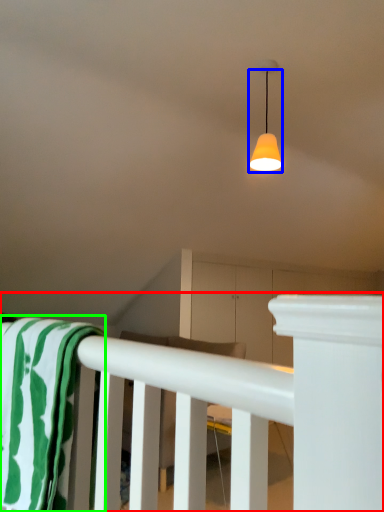
Question: Which object is the farthest from rail (highlighted by a red box)? Choose among these: lamp (highlighted by a blue box) or beach towel (highlighted by a green box).

Choices:
 (A) lamp
 (B) beach towel

Answer: (A)